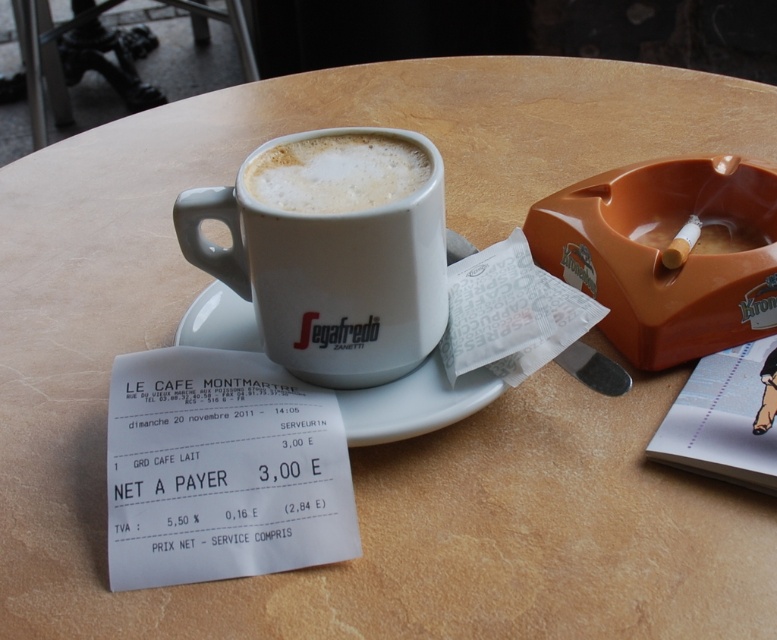
Question: Is white ceramic mug at center wider than white frothy foam at center?

Choices:
 (A) no
 (B) yes

Answer: (B)

Question: Among these objects, which one is farthest from the camera?

Choices:
 (A) white ceramic mug at center
 (B) white ceramic saucer at center
 (C) white frothy foam at center

Answer: (B)

Question: Is white ceramic mug at center bigger than white frothy foam at center?

Choices:
 (A) yes
 (B) no

Answer: (A)

Question: Which is nearer to the white frothy foam at center?

Choices:
 (A) white ceramic saucer at center
 (B) white ceramic mug at center

Answer: (B)

Question: Which object is closer to the camera taking this photo?

Choices:
 (A) white ceramic mug at center
 (B) white frothy foam at center
 (C) white ceramic saucer at center

Answer: (A)

Question: In this image, where is white ceramic mug at center located relative to white ceramic saucer at center?

Choices:
 (A) left
 (B) right

Answer: (A)